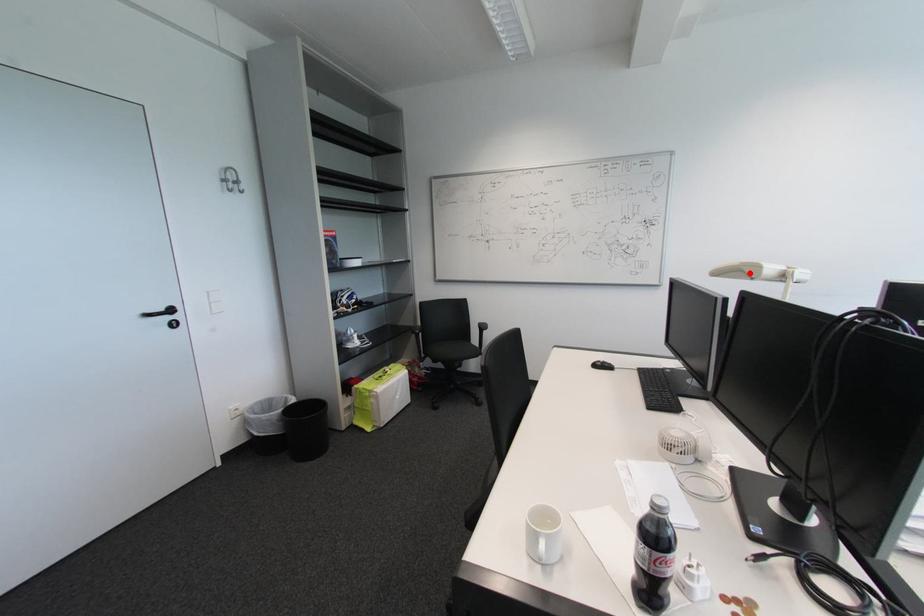
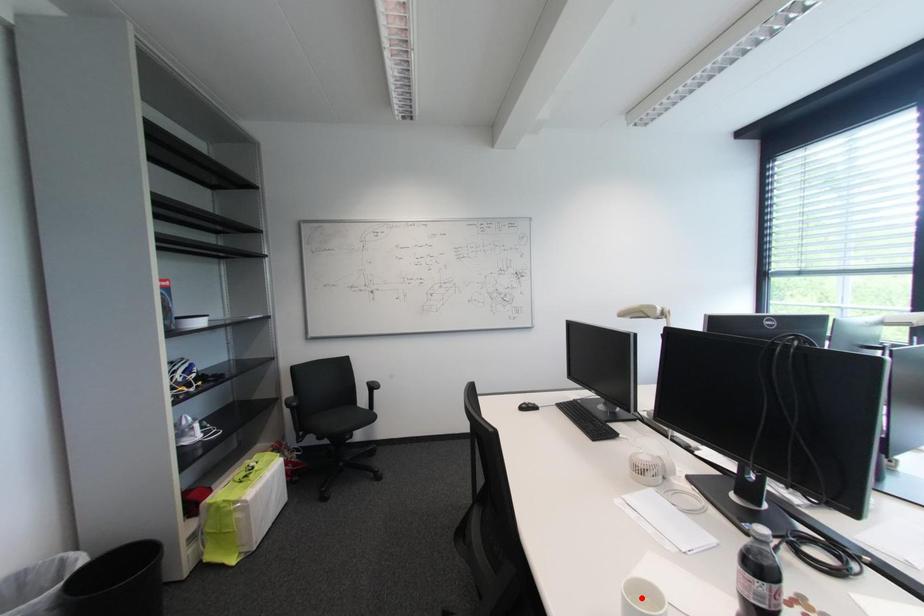
I am providing you with two images of the same scene from different viewpoints. A red point is marked on the first image and another point is marked on the second image. Is the red point in image1 aligned with the point shown in image2?

No